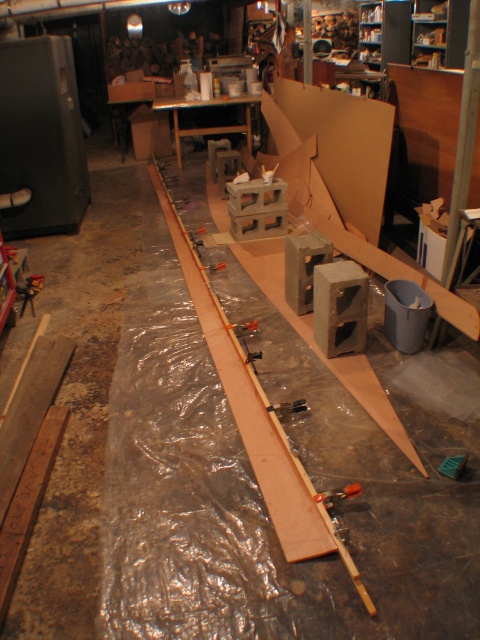
You are standing in a workshop where a long wooden plank is placed on a plastic sheet. You see a point marked at coordinates (212, 125). What does this point indicate?

The point at (212, 125) indicates matte gray concrete blocks at center.

You are standing in the workshop and need to place a tool exactly halfway between point (x=336, y=493) and point (x=271, y=404). Which point will the tool be closer to?

The tool placed halfway between point (x=336, y=493) and point (x=271, y=404) will be closer to point (x=271, y=404) because the halfway point would be at approximately 0.703, 0.633, which is closer to the second point.

You are standing in a workshop and see the matte gray concrete blocks at center. If you want to reach them without moving your feet, can you do it?

The matte gray concrete blocks at center are 6.70 meters away from the viewer, which is too far to reach without moving your feet.